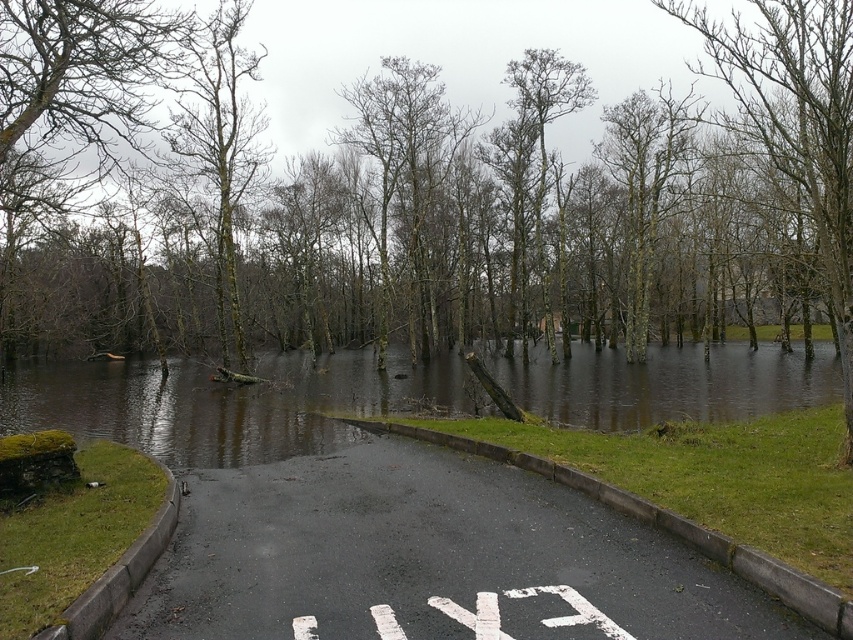
Question: Which object appears closest to the camera in this image?

Choices:
 (A) bare wood tree at center
 (B) green leafless tree at center
 (C) smooth bark tree at upper center
 (D) brown murky water at center

Answer: (C)

Question: Among these objects, which one is farthest from the camera?

Choices:
 (A) bare wood tree at center
 (B) green leafless tree at center
 (C) brown murky water at center

Answer: (A)

Question: Is smooth bark tree at upper center above bare wood tree at center?

Choices:
 (A) no
 (B) yes

Answer: (A)

Question: Does brown murky water at center have a larger size compared to smooth bark tree at upper center?

Choices:
 (A) yes
 (B) no

Answer: (B)

Question: Which is nearer to the brown murky water at center?

Choices:
 (A) smooth bark tree at upper center
 (B) bare wood tree at center

Answer: (B)

Question: Is green leafless tree at center bigger than smooth bark tree at upper center?

Choices:
 (A) yes
 (B) no

Answer: (A)